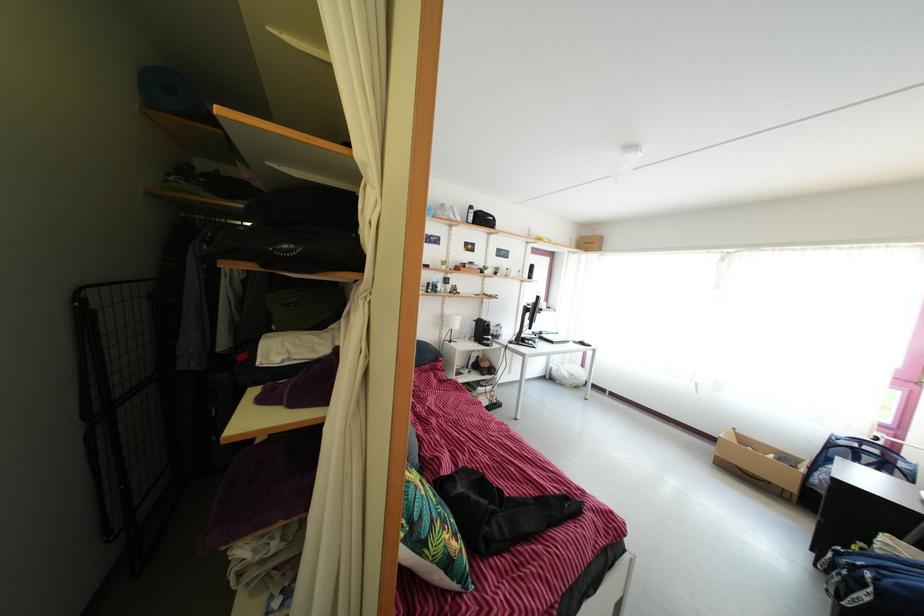
What do you see at coordinates (857, 466) in the screenshot? I see `a chair sitting surface` at bounding box center [857, 466].